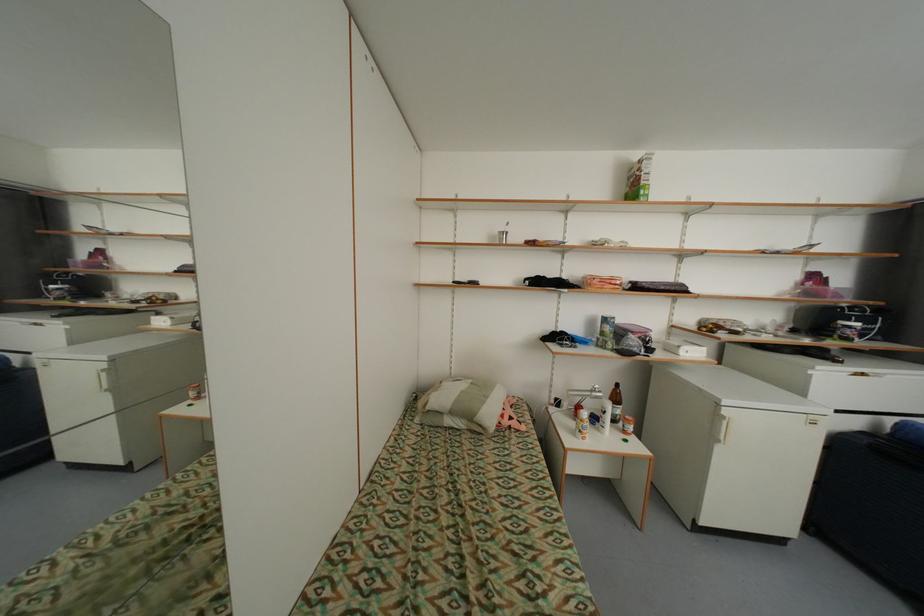
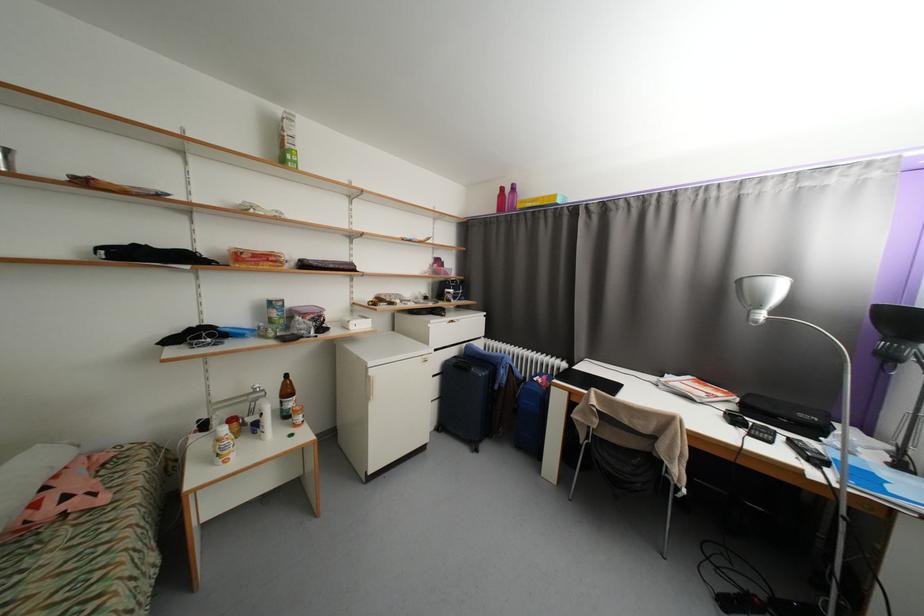
Find the pixel in the second image that matches (622,400) in the first image.

(294, 392)